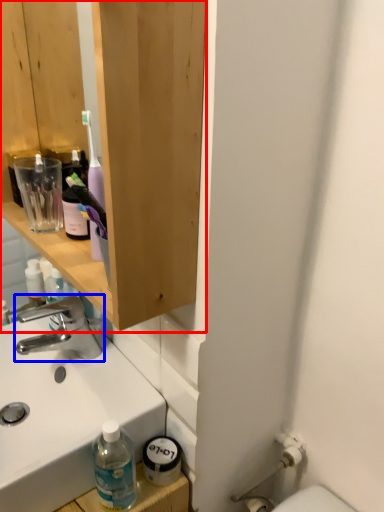
Question: Which object appears closest to the camera in this image, bathroom cabinet (highlighted by a red box) or tap (highlighted by a blue box)?

Choices:
 (A) bathroom cabinet
 (B) tap

Answer: (A)